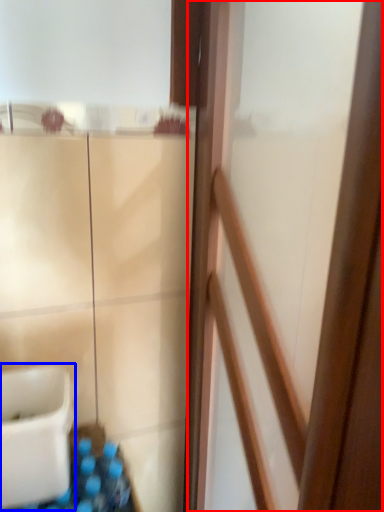
Question: Which object is further to the camera taking this photo, screen door (highlighted by a red box) or sink (highlighted by a blue box)?

Choices:
 (A) screen door
 (B) sink

Answer: (B)